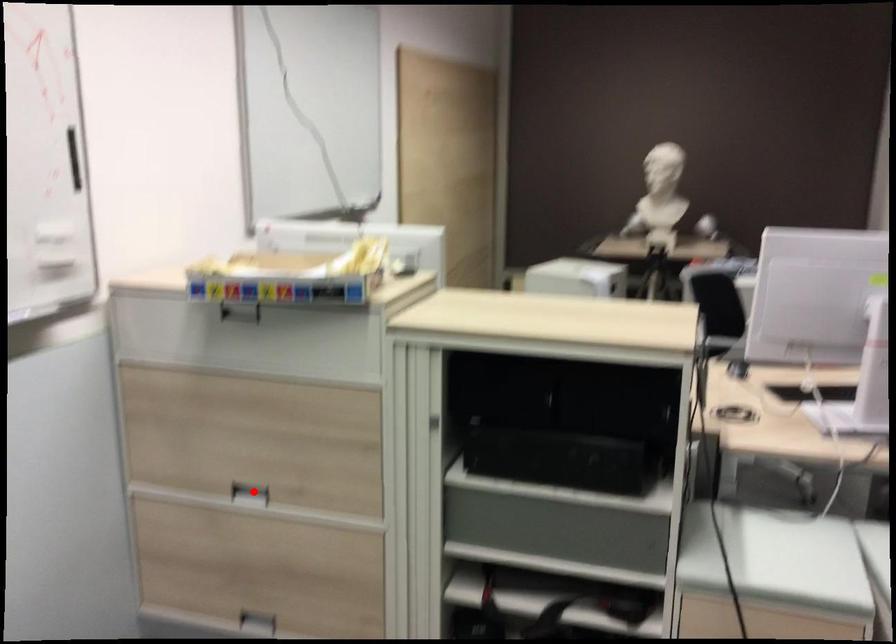
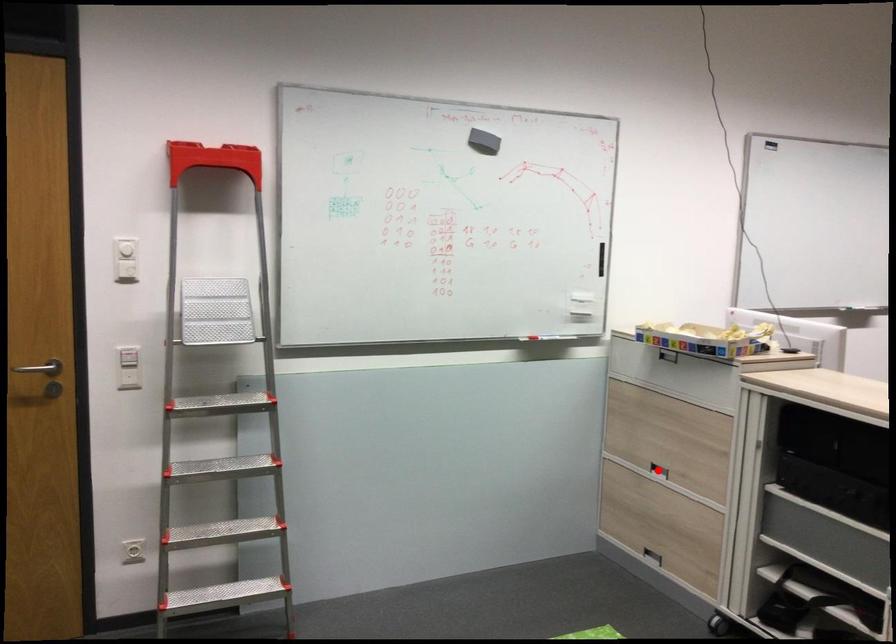
I am providing you with two images of the same scene from different viewpoints. A red point is marked on the first image and another point is marked on the second image. Does the point marked in image1 correspond to the same location as the one in image2?

Yes